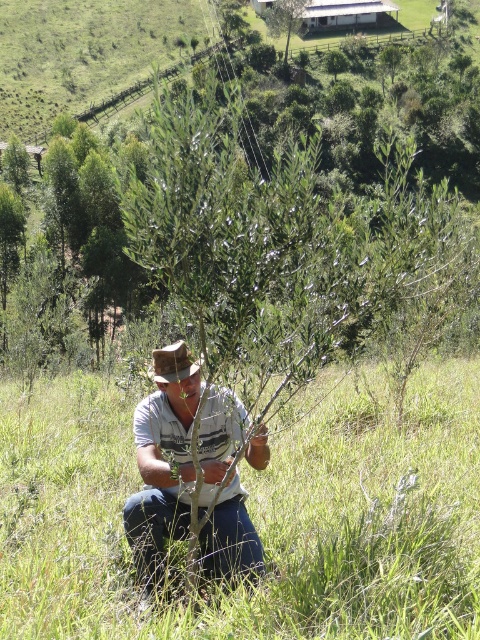
Question: Which is farther from the white cotton shirt at center?

Choices:
 (A) brown felt cowboy hat at center
 (B) green leafy tree at upper center

Answer: (B)

Question: Does green grass at center have a smaller size compared to white cotton shirt at center?

Choices:
 (A) yes
 (B) no

Answer: (B)

Question: Does white cotton shirt at center have a larger size compared to brown felt cowboy hat at center?

Choices:
 (A) yes
 (B) no

Answer: (B)

Question: Does brown felt cowboy hat at center have a lesser width compared to green leafy tree at upper center?

Choices:
 (A) no
 (B) yes

Answer: (B)

Question: Which object appears farthest from the camera in this image?

Choices:
 (A) green grass at center
 (B) green leafy tree at upper center

Answer: (B)

Question: Which object is closer to the camera taking this photo?

Choices:
 (A) green grass at center
 (B) white cotton shirt at center
 (C) brown felt cowboy hat at center

Answer: (A)